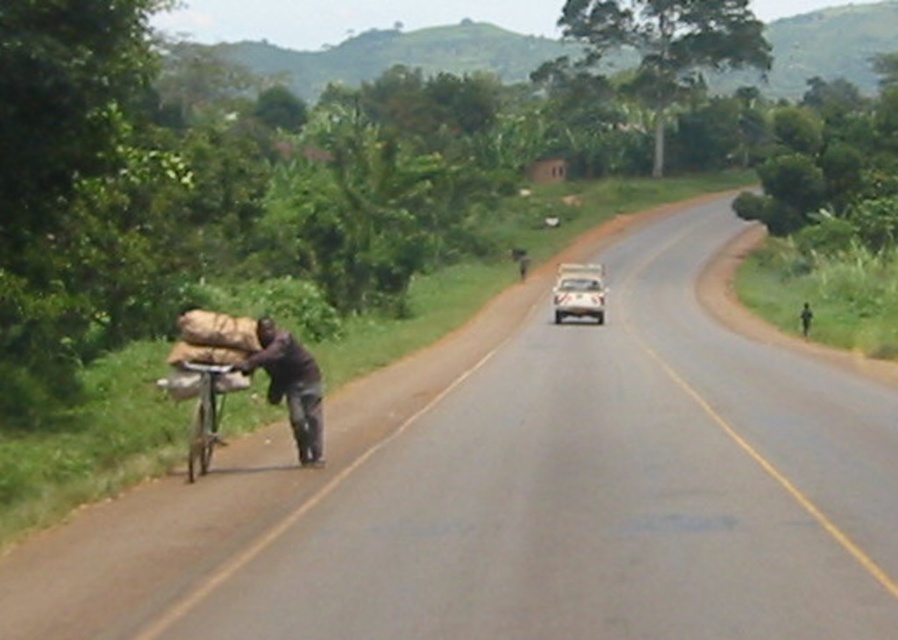
You are a delivery person trying to navigate a narrow path next to the road. You see the dark brown fabric at left and the metallic silver bicycle at left. Which object is higher up relative to the other?

The dark brown fabric at left is located above the metallic silver bicycle at left, so it is higher up.